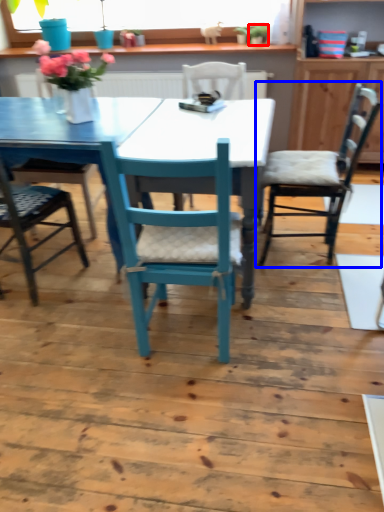
Question: Which point is further to the camera, houseplant (highlighted by a red box) or chair (highlighted by a blue box)?

Choices:
 (A) houseplant
 (B) chair

Answer: (A)